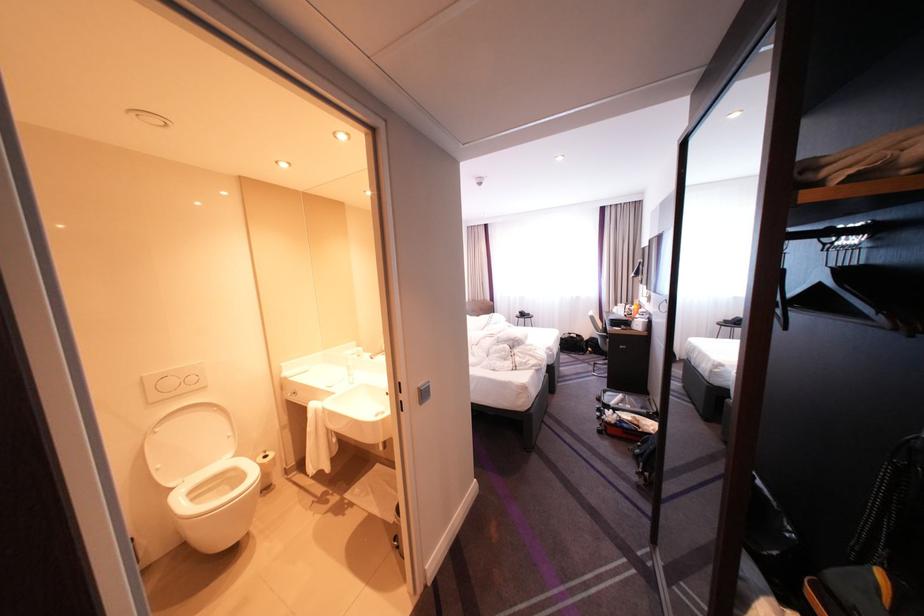
Image resolution: width=924 pixels, height=616 pixels. What do you see at coordinates (349, 369) in the screenshot?
I see `the white soap dispenser` at bounding box center [349, 369].